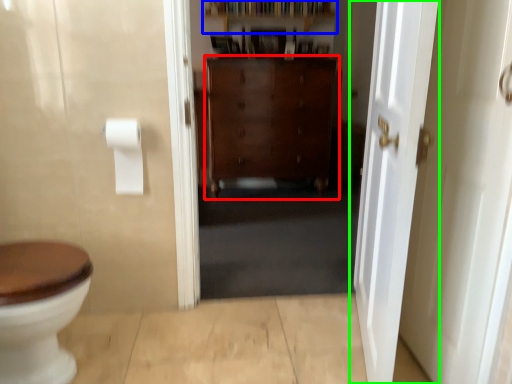
Question: Estimate the real-world distances between objects in this image. Which object is farther from cabinetry (highlighted by a red box), shelf (highlighted by a blue box) or door (highlighted by a green box)?

Choices:
 (A) shelf
 (B) door

Answer: (B)